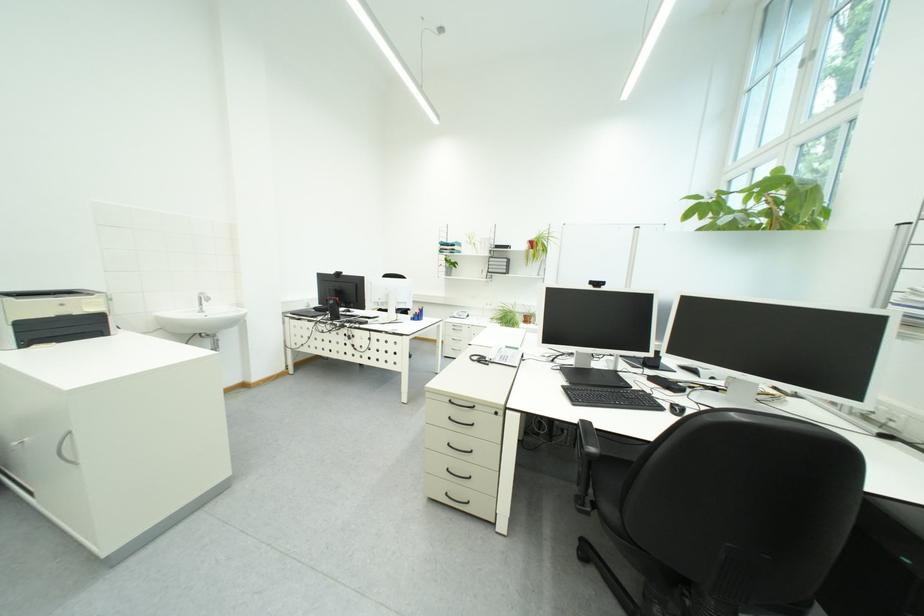
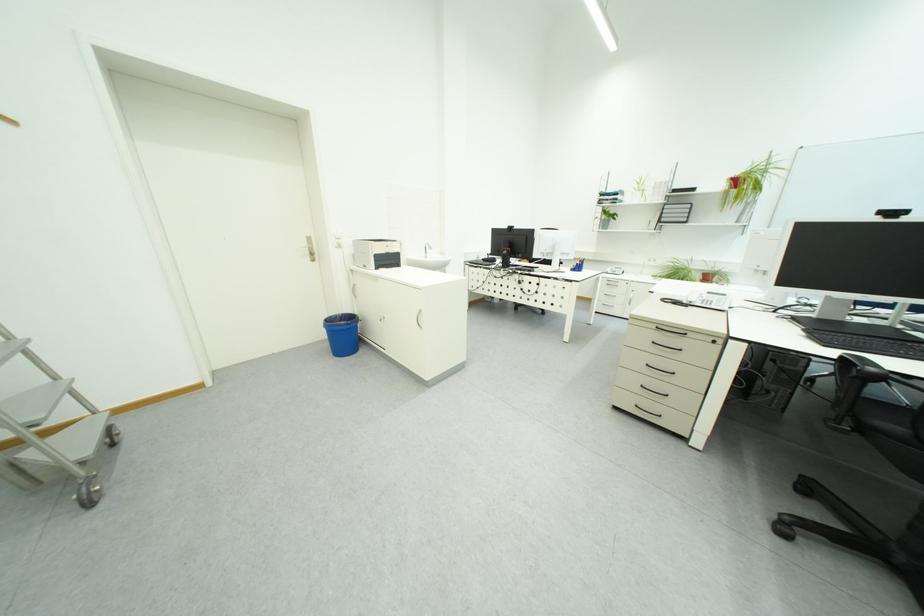
Which direction would the cameraman need to move to produce the second image?

The cameraman walked toward left, backward.